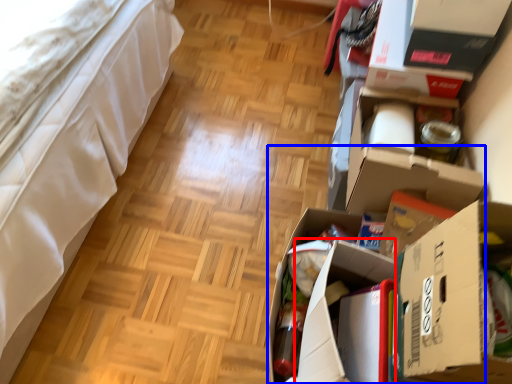
Question: Which object appears closest to the camera in this image, cardboard box (highlighted by a red box) or cardboard box (highlighted by a blue box)?

Choices:
 (A) cardboard box
 (B) cardboard box

Answer: (B)